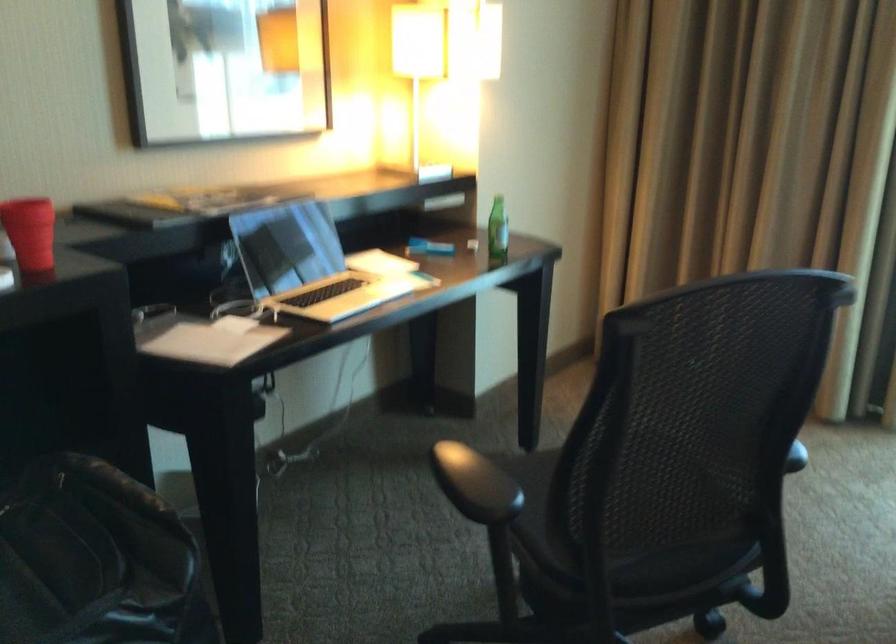
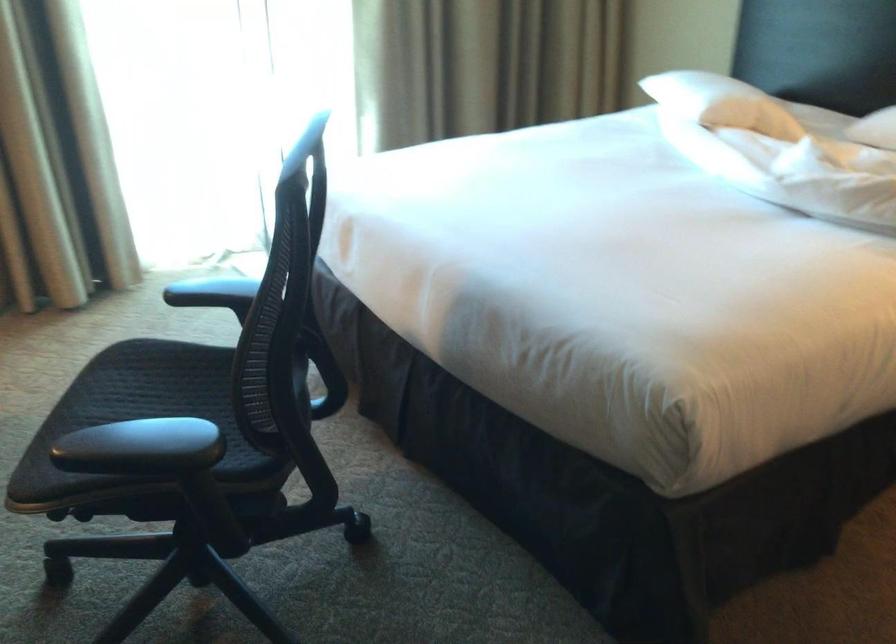
How did the camera likely rotate?

The camera rotated toward right-down.